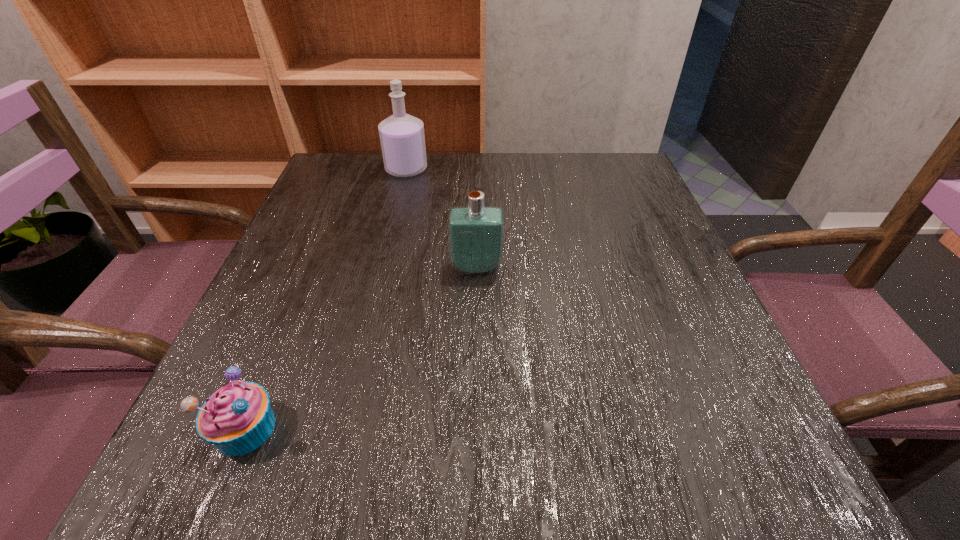
What are the coordinates of `object that is positioned at the near edge` in the screenshot? It's located at (237, 419).

The width and height of the screenshot is (960, 540). Find the location of `perfume at the left edge`. perfume at the left edge is located at coordinates coord(402,138).

What are the coordinates of `muffin that is at the left edge` in the screenshot? It's located at (237, 419).

In order to click on object positioned at the far left corner in this screenshot , I will do `click(402, 138)`.

You are a GUI agent. You are given a task and a screenshot of the screen. Output one action in this format:
    pyautogui.click(x=<x>, y=<y>)
    Task: Click on the object that is at the near left corner
    
    Given the screenshot: What is the action you would take?
    pos(237,419)

This screenshot has height=540, width=960. What are the coordinates of `free spot at the far edge of the desktop` in the screenshot? It's located at (514, 192).

Where is `vacant area at the near edge`? The height and width of the screenshot is (540, 960). vacant area at the near edge is located at coordinates (477, 488).

Locate an element on the screen. The height and width of the screenshot is (540, 960). vacant space at the left edge of the desktop is located at coordinates point(307,244).

In the image, there is a desktop. Where is `vacant area at the right edge`? This screenshot has height=540, width=960. vacant area at the right edge is located at coordinates (621, 310).

In the image, there is a desktop. Identify the location of vacant region at the far left corner. (376, 171).